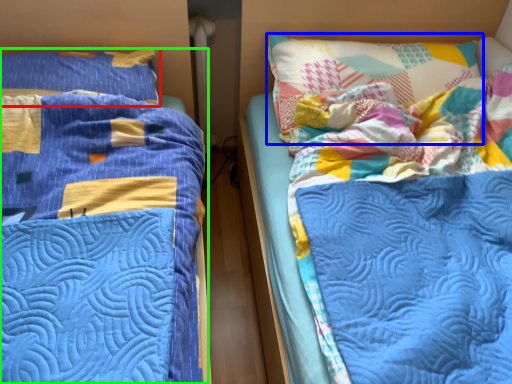
Question: Which object is positioned farthest from pillow (highlighted by a red box)? Select from pillow (highlighted by a blue box) and bed (highlighted by a green box).

Choices:
 (A) pillow
 (B) bed

Answer: (A)